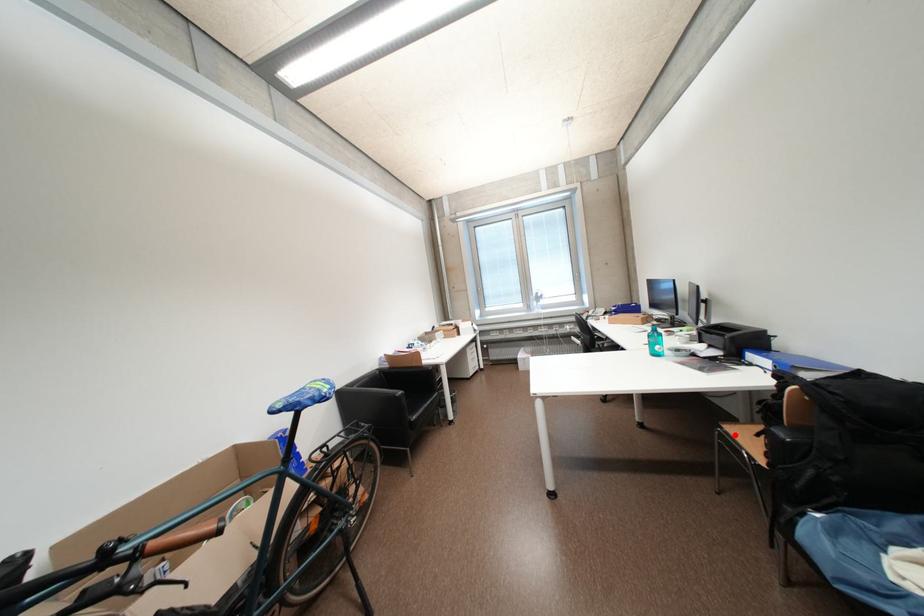
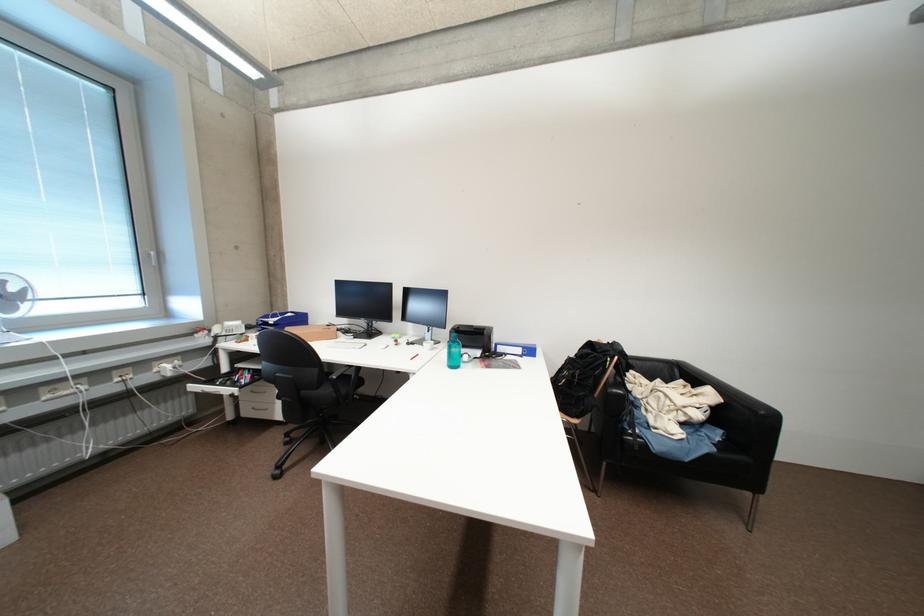
Question: I am providing you with two images of the same scene from different viewpoints. A red point is marked on the first image. Can you still see the location of the red point in image 2?

Choices:
 (A) Yes
 (B) No

Answer: (B)